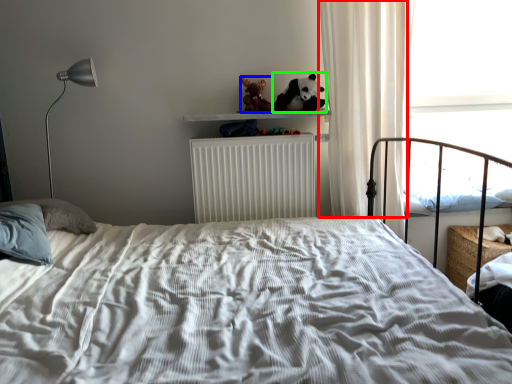
Question: Which object is positioned closest to curtain (highlighted by a red box)? Select from figurine (highlighted by a blue box) and panda (highlighted by a green box).

Choices:
 (A) figurine
 (B) panda

Answer: (B)